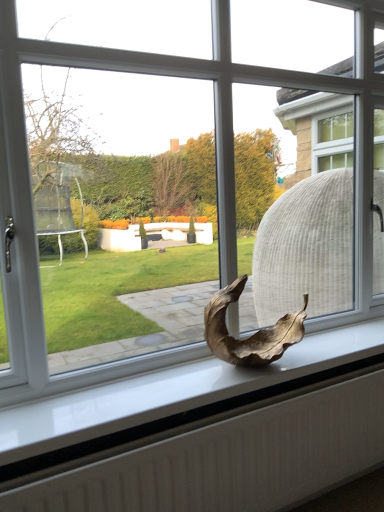
Question: Considering the positions of dry leaf at center and white textured radiator at lower center in the image, is dry leaf at center wider or thinner than white textured radiator at lower center?

Choices:
 (A) wide
 (B) thin

Answer: (A)

Question: Is dry leaf at center spatially inside white textured radiator at lower center, or outside of it?

Choices:
 (A) outside
 (B) inside

Answer: (A)

Question: Is dry leaf at center to the left or to the right of white textured radiator at lower center in the image?

Choices:
 (A) left
 (B) right

Answer: (B)

Question: From the image's perspective, is white textured radiator at lower center located above or below dry leaf at center?

Choices:
 (A) below
 (B) above

Answer: (A)

Question: From their relative heights in the image, would you say white textured radiator at lower center is taller or shorter than dry leaf at center?

Choices:
 (A) tall
 (B) short

Answer: (A)

Question: Is white textured radiator at lower center wider or thinner than dry leaf at center?

Choices:
 (A) thin
 (B) wide

Answer: (A)

Question: Considering the relative positions of white textured radiator at lower center and dry leaf at center in the image provided, is white textured radiator at lower center to the left or to the right of dry leaf at center?

Choices:
 (A) left
 (B) right

Answer: (A)